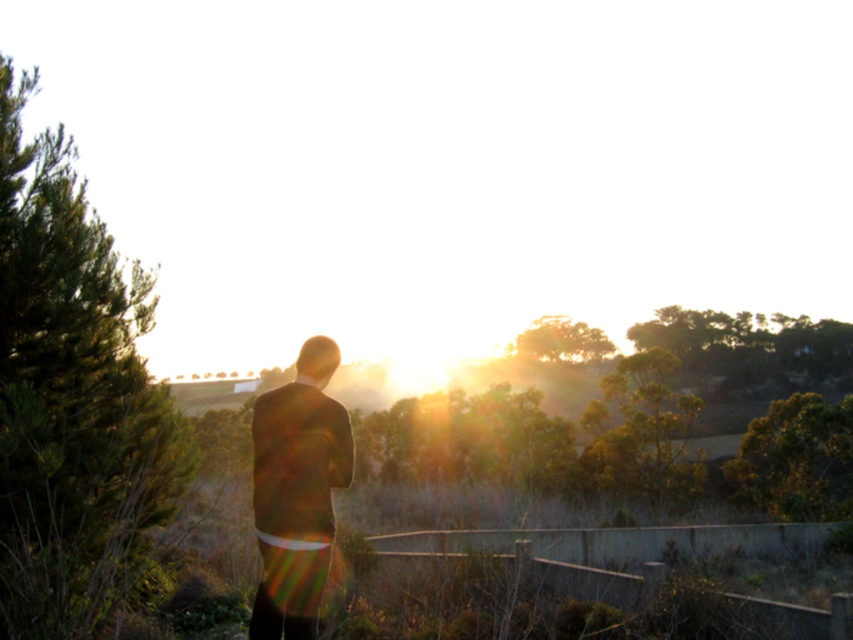
Question: Is green leafy tree at left further to the viewer compared to green leafy tree at center?

Choices:
 (A) yes
 (B) no

Answer: (B)

Question: Does dark brown suit at center appear over green leafy tree at center?

Choices:
 (A) no
 (B) yes

Answer: (B)

Question: Does green leafy tree at left come in front of green leafy tree at center?

Choices:
 (A) no
 (B) yes

Answer: (B)

Question: Considering the real-world distances, which object is closest to the green leafy tree at left?

Choices:
 (A) green leafy tree at right
 (B) green leafy tree at center

Answer: (A)

Question: Estimate the real-world distances between objects in this image. Which object is closer to the dark brown suit at center?

Choices:
 (A) green leafy tree at center
 (B) green leafy tree at right
 (C) green leafy tree at left

Answer: (C)

Question: Among these points, which one is nearest to the camera?

Choices:
 (A) (282, 524)
 (B) (80, 460)

Answer: (A)